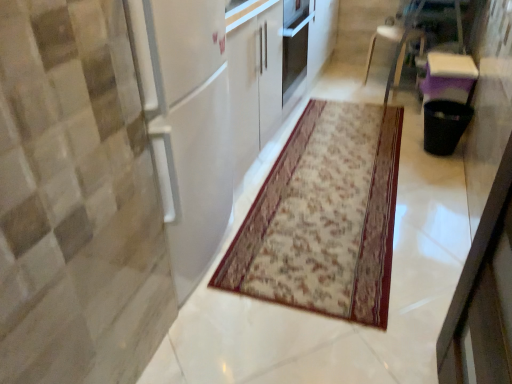
What is the approximate height of patterned carpet at center?

patterned carpet at center is 0.95 inches in height.

Measure the distance between patterned carpet at center and camera.

patterned carpet at center and camera are 1.52 meters apart.

What do you see at coordinates (324, 217) in the screenshot? Image resolution: width=512 pixels, height=384 pixels. I see `patterned carpet at center` at bounding box center [324, 217].

Locate an element on the screen. patterned carpet at center is located at coordinates (324, 217).

Describe the element at coordinates (394, 42) in the screenshot. The width and height of the screenshot is (512, 384). I see `white plastic chair at upper right` at that location.

At what (x,y) coordinates should I click in order to perform the action: click on white plastic chair at upper right. Please return your answer as a coordinate pair (x, y). The height and width of the screenshot is (384, 512). Looking at the image, I should click on (394, 42).

Find the location of a particular element. The width and height of the screenshot is (512, 384). patterned carpet at center is located at coordinates (324, 217).

Between white plastic chair at upper right and patterned carpet at center, which one appears on the left side from the viewer's perspective?

patterned carpet at center.

Considering the positions of objects white plastic chair at upper right and patterned carpet at center in the image provided, who is behind, white plastic chair at upper right or patterned carpet at center?

white plastic chair at upper right is behind.

Which is closer to the camera, (x=401, y=67) or (x=311, y=201)?

Point (x=401, y=67).

From the image's perspective, is white plastic chair at upper right positioned above or below patterned carpet at center?

white plastic chair at upper right is above patterned carpet at center.

From a real-world perspective, who is located higher, white plastic chair at upper right or patterned carpet at center?

From a 3D spatial view, white plastic chair at upper right is above.

Considering the relative sizes of white plastic chair at upper right and patterned carpet at center in the image provided, is white plastic chair at upper right wider than patterned carpet at center?

No, white plastic chair at upper right is not wider than patterned carpet at center.

Does white plastic chair at upper right have a greater height compared to patterned carpet at center?

Correct, white plastic chair at upper right is much taller as patterned carpet at center.

Considering the sizes of objects white plastic chair at upper right and patterned carpet at center in the image provided, who is bigger, white plastic chair at upper right or patterned carpet at center?

Bigger between the two is white plastic chair at upper right.

Can we say white plastic chair at upper right lies outside patterned carpet at center?

white plastic chair at upper right is positioned outside patterned carpet at center.

In the scene shown: Is white plastic chair at upper right placed right next to patterned carpet at center?

They are not placed beside each other.

Is patterned carpet at center at the back of white plastic chair at upper right?

No, white plastic chair at upper right's orientation is not away from patterned carpet at center.

Can you tell me how much white plastic chair at upper right and patterned carpet at center differ in facing direction?

The facing directions of white plastic chair at upper right and patterned carpet at center are 108 degrees apart.

The image size is (512, 384). Identify the location of furniture behind the patterned carpet at center. (394, 42).

Considering the positions of objects patterned carpet at center and white plastic chair at upper right in the image provided, who is more to the left, patterned carpet at center or white plastic chair at upper right?

patterned carpet at center is more to the left.

Consider the image. Which object is closer to the camera taking this photo, patterned carpet at center or white plastic chair at upper right?

Positioned in front is patterned carpet at center.

Is point (378, 262) less distant than point (399, 29)?

Yes, it is in front of point (399, 29).

From the image's perspective, does patterned carpet at center appear lower than white plastic chair at upper right?

Yes, from the image's perspective, patterned carpet at center is beneath white plastic chair at upper right.

From a real-world perspective, is patterned carpet at center under white plastic chair at upper right?

Yes, from a real-world perspective, patterned carpet at center is below white plastic chair at upper right.

Considering the relative sizes of patterned carpet at center and white plastic chair at upper right in the image provided, is patterned carpet at center thinner than white plastic chair at upper right?

No, patterned carpet at center is not thinner than white plastic chair at upper right.

Is patterned carpet at center taller than white plastic chair at upper right?

No, patterned carpet at center is not taller than white plastic chair at upper right.

Who is smaller, patterned carpet at center or white plastic chair at upper right?

patterned carpet at center.

From the picture: Is patterned carpet at center situated inside white plastic chair at upper right or outside?

patterned carpet at center is located beyond the bounds of white plastic chair at upper right.

Would you consider patterned carpet at center to be distant from white plastic chair at upper right?

Yes, patterned carpet at center is far from white plastic chair at upper right.

Is patterned carpet at center aimed at white plastic chair at upper right?

No, patterned carpet at center is not aimed at white plastic chair at upper right.

You are a GUI agent. You are given a task and a screenshot of the screen. Output one action in this format:
    pyautogui.click(x=<x>, y=<y>)
    Task: Click on the furniture lying behind the patterned carpet at center
    This screenshot has height=384, width=512.
    Given the screenshot: What is the action you would take?
    pyautogui.click(x=394, y=42)

What are the coordinates of `furniture above the patterned carpet at center (from a real-world perspective)` in the screenshot? It's located at (394, 42).

The height and width of the screenshot is (384, 512). What are the coordinates of `mat in front of the white plastic chair at upper right` in the screenshot? It's located at coord(324,217).